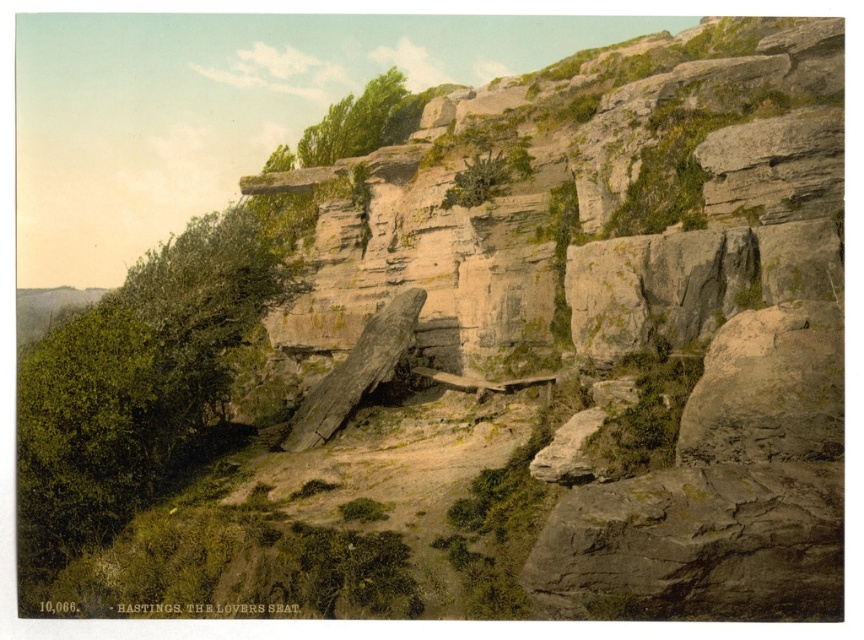
Who is more distant from viewer, (89, 460) or (693, 420)?

The point (89, 460) is more distant.

Is green leafy bush at left positioned in front of smooth gray rock at center right?

No, green leafy bush at left is behind smooth gray rock at center right.

I want to click on green leafy bush at left, so click(137, 384).

Does smooth gray rock at center right have a greater height compared to green leafy tree at upper center?

In fact, smooth gray rock at center right may be shorter than green leafy tree at upper center.

Can you confirm if smooth gray rock at center right is shorter than green leafy tree at upper center?

Yes.

The image size is (864, 640). Identify the location of smooth gray rock at center right. pos(767,388).

Between gray rock at center and green leafy tree at upper center, which one appears on the right side from the viewer's perspective?

Positioned to the right is gray rock at center.

Who is shorter, gray rock at center or green leafy tree at upper center?

With less height is gray rock at center.

Locate an element on the screen. This screenshot has width=864, height=640. gray rock at center is located at coordinates (653, 289).